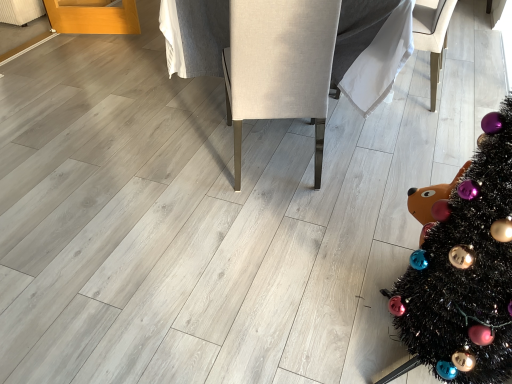
I want to click on unoccupied space behind black tinsel christmas tree at lower right, so click(362, 246).